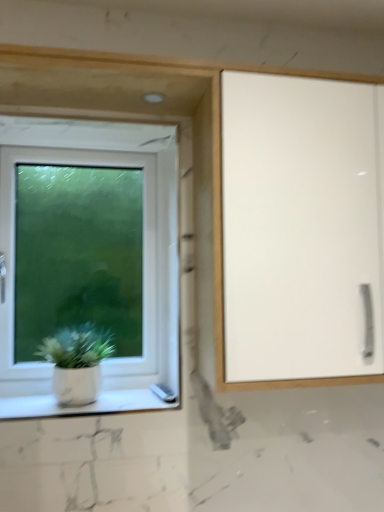
This screenshot has height=512, width=384. Identify the location of white plastic window at left. (88, 256).

The width and height of the screenshot is (384, 512). Identify the location of white matte pot at lower left. (77, 362).

Locate an element on the screen. The image size is (384, 512). white plastic window at left is located at coordinates 88,256.

Between white matte pot at lower left and white glossy cabinet at right, which one has more height?

Standing taller between the two is white glossy cabinet at right.

Which is closer, (64, 387) or (357, 272)?

Point (64, 387) is positioned farther from the camera compared to point (357, 272).

Is white matte pot at lower left situated inside white glossy cabinet at right or outside?

white matte pot at lower left is spatially situated outside white glossy cabinet at right.

How different are the orientations of white matte pot at lower left and white glossy cabinet at right in degrees?

The angle between the facing direction of white matte pot at lower left and the facing direction of white glossy cabinet at right is 0.022 degrees.

Is white matte pot at lower left oriented away from white marble window sill at lower left?

No.

From a real-world perspective, does white matte pot at lower left stand above white marble window sill at lower left?

Yes.

In terms of size, does white matte pot at lower left appear bigger or smaller than white marble window sill at lower left?

In the image, white matte pot at lower left appears to be larger than white marble window sill at lower left.

Between white matte pot at lower left and white marble window sill at lower left, which one appears on the left side from the viewer's perspective?

Positioned to the left is white matte pot at lower left.

From the image's perspective, is white marble window sill at lower left located above white plastic window at left?

No, from the image's perspective, white marble window sill at lower left is not above white plastic window at left.

Is white marble window sill at lower left looking in the opposite direction of white plastic window at left?

white marble window sill at lower left does not have its back to white plastic window at left.

Considering the relative sizes of white marble window sill at lower left and white plastic window at left in the image provided, is white marble window sill at lower left taller than white plastic window at left?

In fact, white marble window sill at lower left may be shorter than white plastic window at left.

From the picture: Looking at their sizes, would you say white matte pot at lower left is wider or thinner than white plastic window at left?

white matte pot at lower left is wider than white plastic window at left.

From a real-world perspective, is white matte pot at lower left beneath white plastic window at left?

Yes, from a real-world perspective, white matte pot at lower left is below white plastic window at left.

Is white matte pot at lower left positioned beyond the bounds of white plastic window at left?

white matte pot at lower left is positioned outside white plastic window at left.

Looking at this image, is white matte pot at lower left far away from white plastic window at left?

No, white matte pot at lower left is not far from white plastic window at left.

In the image, is white glossy cabinet at right positioned in front of or behind white plastic window at left?

Clearly, white glossy cabinet at right is in front of white plastic window at left.

Is white glossy cabinet at right at the left side of white plastic window at left?

No, white glossy cabinet at right is not to the left of white plastic window at left.

Can you confirm if white glossy cabinet at right is wider than white plastic window at left?

Yes.

Does point (289, 124) come closer to viewer compared to point (154, 328)?

That is True.

Which is behind, white glossy cabinet at right or white matte pot at lower left?

Positioned behind is white matte pot at lower left.

Which object is positioned more to the right, white glossy cabinet at right or white matte pot at lower left?

white glossy cabinet at right.

Is point (260, 201) behind point (75, 394)?

No, (260, 201) is closer to viewer.

Between white glossy cabinet at right and white matte pot at lower left, which one has larger width?

white glossy cabinet at right.

From the image's perspective, is white plastic window at left on white matte pot at lower left?

Correct, white plastic window at left appears higher than white matte pot at lower left in the image.

Considering the relative positions of white plastic window at left and white matte pot at lower left in the image provided, is white plastic window at left to the left of white matte pot at lower left from the viewer's perspective?

Yes.

Considering the positions of objects white plastic window at left and white matte pot at lower left in the image provided, who is in front, white plastic window at left or white matte pot at lower left?

white matte pot at lower left is in front.

Measure the distance between white plastic window at left and white matte pot at lower left.

white plastic window at left is 24.61 centimeters from white matte pot at lower left.

Locate an element on the screen. houseplant that appears below the white glossy cabinet at right (from a real-world perspective) is located at coordinates (77, 362).

The height and width of the screenshot is (512, 384). Identify the location of houseplant behind the white marble window sill at lower left. (77, 362).

From the image, which object appears to be nearer to white glossy cabinet at right, white marble window sill at lower left or white matte pot at lower left?

white marble window sill at lower left.

From the image, which object appears to be nearer to white matte pot at lower left, white plastic window at left or white glossy cabinet at right?

white plastic window at left lies closer to white matte pot at lower left than the other object.

Estimate the real-world distances between objects in this image. Which object is further from white marble window sill at lower left, white matte pot at lower left or white glossy cabinet at right?

Among the two, white glossy cabinet at right is located further to white marble window sill at lower left.

Looking at this image, from the image, which object appears to be nearer to white marble window sill at lower left, white glossy cabinet at right or white matte pot at lower left?

white matte pot at lower left is positioned closer to the anchor white marble window sill at lower left.

Looking at the image, which one is located closer to white marble window sill at lower left, white matte pot at lower left or white plastic window at left?

Among the two, white matte pot at lower left is located nearer to white marble window sill at lower left.

Estimate the real-world distances between objects in this image. Which object is closer to white glossy cabinet at right, white plastic window at left or white matte pot at lower left?

white plastic window at left lies closer to white glossy cabinet at right than the other object.

Estimate the real-world distances between objects in this image. Which object is further from white matte pot at lower left, white glossy cabinet at right or white marble window sill at lower left?

The object further to white matte pot at lower left is white glossy cabinet at right.

From the image, which object appears to be farther from white plastic window at left, white matte pot at lower left or white glossy cabinet at right?

Among the two, white glossy cabinet at right is located further to white plastic window at left.

The image size is (384, 512). I want to click on window sill situated between white plastic window at left and white glossy cabinet at right from left to right, so click(x=82, y=406).

The image size is (384, 512). I want to click on houseplant between white plastic window at left and white marble window sill at lower left in the vertical direction, so click(77, 362).

Identify the location of window sill between white matte pot at lower left and white glossy cabinet at right from left to right. (82, 406).

Identify the location of houseplant between white plastic window at left and white glossy cabinet at right in the horizontal direction. This screenshot has height=512, width=384. (77, 362).